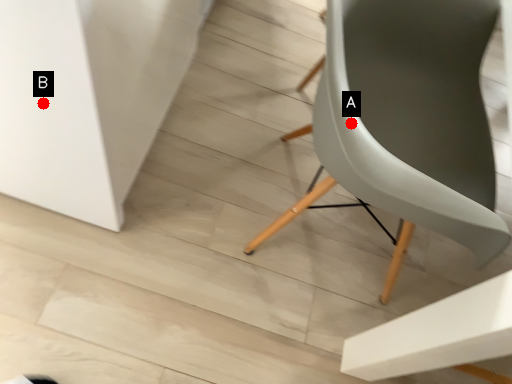
Question: Two points are circled on the image, labeled by A and B beside each circle. Among these points, which one is nearest to the camera?

Choices:
 (A) A is closer
 (B) B is closer

Answer: (A)